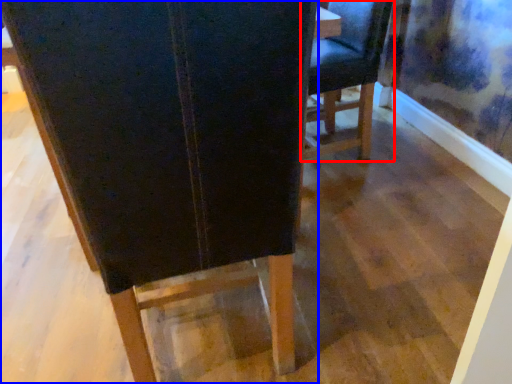
Question: Among these objects, which one is nearest to the camera, chair (highlighted by a red box) or chair (highlighted by a blue box)?

Choices:
 (A) chair
 (B) chair

Answer: (B)